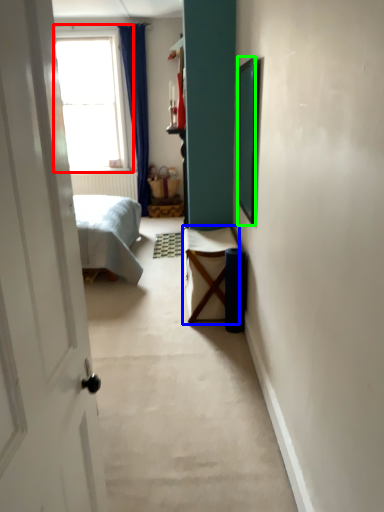
Question: Which is farther away from window (highlighted by a red box)? furniture (highlighted by a blue box) or picture frame (highlighted by a green box)?

Choices:
 (A) furniture
 (B) picture frame

Answer: (B)